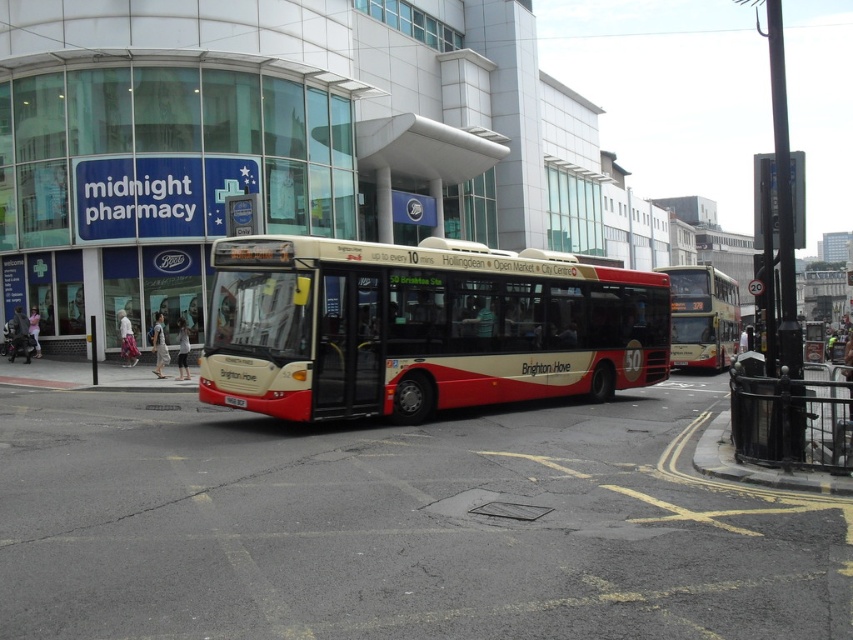
Can you confirm if red matte bus at center is thinner than gold metallic bus at right?

Yes, red matte bus at center is thinner than gold metallic bus at right.

Is point (375, 273) more distant than point (682, 266)?

That is False.

Measure the distance between point (329, 349) and camera.

A distance of 11.56 meters exists between point (329, 349) and camera.

Find the location of a particular element. red matte bus at center is located at coordinates (421, 326).

Which is behind, point (502, 381) or point (718, 432)?

Point (502, 381)

The height and width of the screenshot is (640, 853). Identify the location of red matte bus at center. (421, 326).

Can you confirm if gold metallic bus at right is positioned above black metal curb at lower right?

Yes, gold metallic bus at right is above black metal curb at lower right.

Does gold metallic bus at right have a larger size compared to black metal curb at lower right?

Yes, gold metallic bus at right is bigger than black metal curb at lower right.

The width and height of the screenshot is (853, 640). What are the coordinates of `gold metallic bus at right` in the screenshot? It's located at (701, 316).